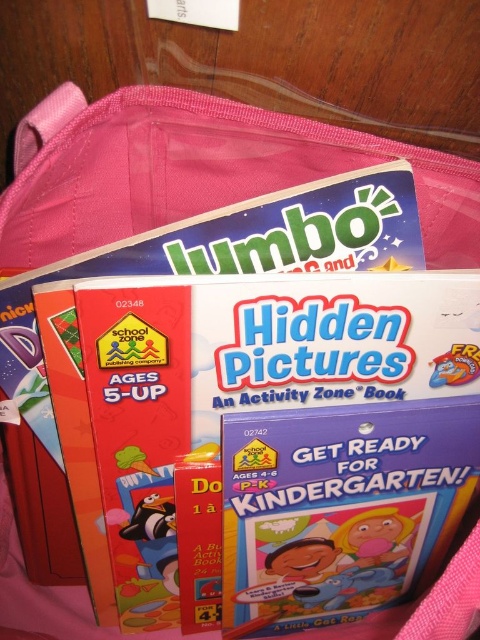
Does point (423, 305) lie behind point (120, 467)?

No, it is in front of (120, 467).

Does white paper lunch box at center have a greater height compared to green matte ice cream cone at center?

Yes, white paper lunch box at center is taller than green matte ice cream cone at center.

I want to click on white paper lunch box at center, so click(x=230, y=385).

Between white paper lunch box at center and shiny metallic sticker at center, which one appears on the left side from the viewer's perspective?

white paper lunch box at center is more to the left.

Which is more to the right, white paper lunch box at center or shiny metallic sticker at center?

Positioned to the right is shiny metallic sticker at center.

I want to click on white paper lunch box at center, so click(x=230, y=385).

Does point (109, 547) come closer to viewer compared to point (372, 540)?

Yes, point (109, 547) is closer to viewer.

Find the location of a particular element. white paper lunch box at center is located at coordinates (230, 385).